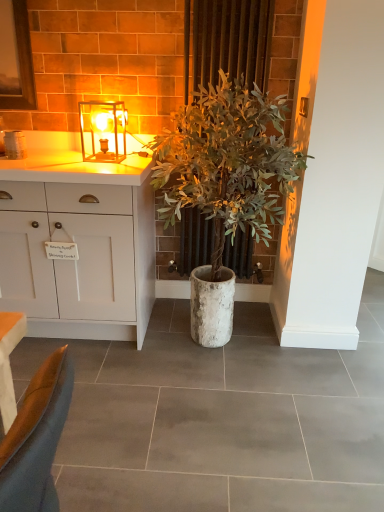
Question: Is matte glass lamp at upper center thinner than green leafy plant at center?

Choices:
 (A) yes
 (B) no

Answer: (A)

Question: Considering the relative sizes of matte glass lamp at upper center and green leafy plant at center in the image provided, is matte glass lamp at upper center taller than green leafy plant at center?

Choices:
 (A) yes
 (B) no

Answer: (B)

Question: From the image's perspective, is matte glass lamp at upper center above green leafy plant at center?

Choices:
 (A) no
 (B) yes

Answer: (B)

Question: Considering the relative positions of matte glass lamp at upper center and green leafy plant at center in the image provided, is matte glass lamp at upper center to the right of green leafy plant at center from the viewer's perspective?

Choices:
 (A) yes
 (B) no

Answer: (B)

Question: From a real-world perspective, is matte glass lamp at upper center under green leafy plant at center?

Choices:
 (A) no
 (B) yes

Answer: (A)

Question: Is point (81, 138) positioned closer to the camera than point (102, 198)?

Choices:
 (A) closer
 (B) farther

Answer: (B)

Question: In the image, is matte glass lamp at upper center positioned in front of or behind white matte cabinet at left?

Choices:
 (A) front
 (B) behind

Answer: (B)

Question: Considering the positions of matte glass lamp at upper center and white matte cabinet at left in the image, is matte glass lamp at upper center wider or thinner than white matte cabinet at left?

Choices:
 (A) thin
 (B) wide

Answer: (A)

Question: From the image's perspective, relative to white matte cabinet at left, is matte glass lamp at upper center above or below?

Choices:
 (A) below
 (B) above

Answer: (B)

Question: Is point (125, 145) closer or farther from the camera than point (193, 86)?

Choices:
 (A) closer
 (B) farther

Answer: (B)

Question: From a real-world perspective, is matte glass lamp at upper center positioned above or below green leafy plant at center?

Choices:
 (A) above
 (B) below

Answer: (A)

Question: Is matte glass lamp at upper center in front of or behind green leafy plant at center in the image?

Choices:
 (A) behind
 (B) front

Answer: (A)

Question: Is matte glass lamp at upper center taller or shorter than green leafy plant at center?

Choices:
 (A) tall
 (B) short

Answer: (B)

Question: In terms of width, does matte glass lamp at upper center look wider or thinner when compared to green leafy plant at center?

Choices:
 (A) wide
 (B) thin

Answer: (B)

Question: Choose the correct answer: Is matte glass lamp at upper center inside green leafy plant at center or outside it?

Choices:
 (A) outside
 (B) inside

Answer: (A)